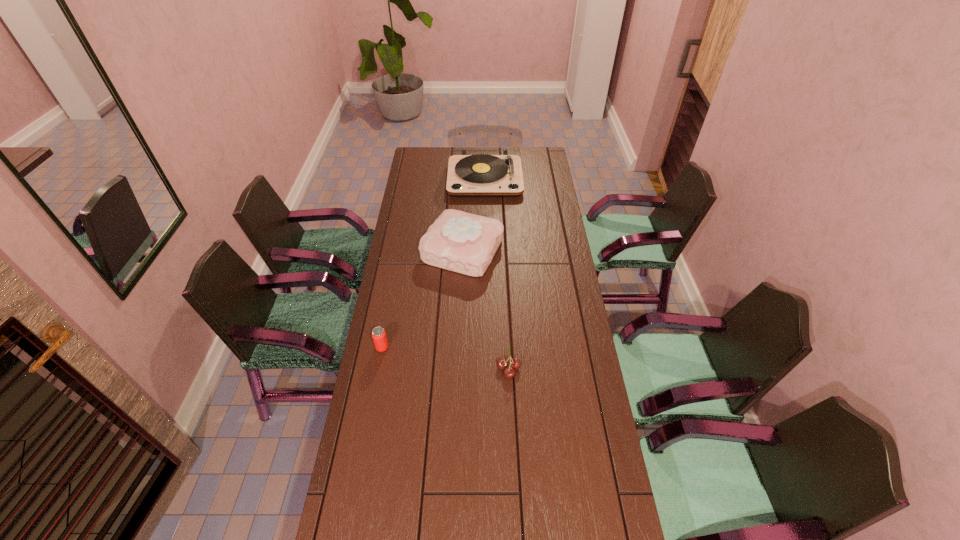
This screenshot has height=540, width=960. I want to click on free point between the beer can and the cake, so click(422, 299).

This screenshot has height=540, width=960. I want to click on object that stands as the third closest to the nearest object, so click(x=480, y=175).

Identify which object is the second closest to the beer can. Please provide its 2D coordinates. Your answer should be formatted as a tuple, i.e. [(x, y)], where the tuple contains the x and y coordinates of a point satisfying the conditions above.

[(509, 372)]